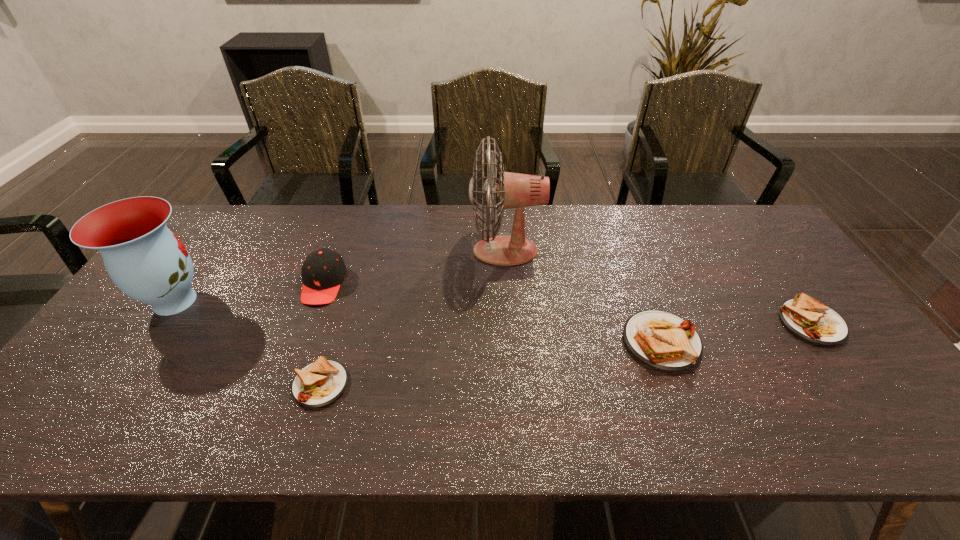
If we want them evenly spaced by inserting an extra sandwich among them, please locate a free spot for this new sandwich. Please provide its 2D coordinates. Your answer should be formatted as a tuple, i.e. [(x, y)], where the tuple contains the x and y coordinates of a point satisfying the conditions above.

[(498, 362)]